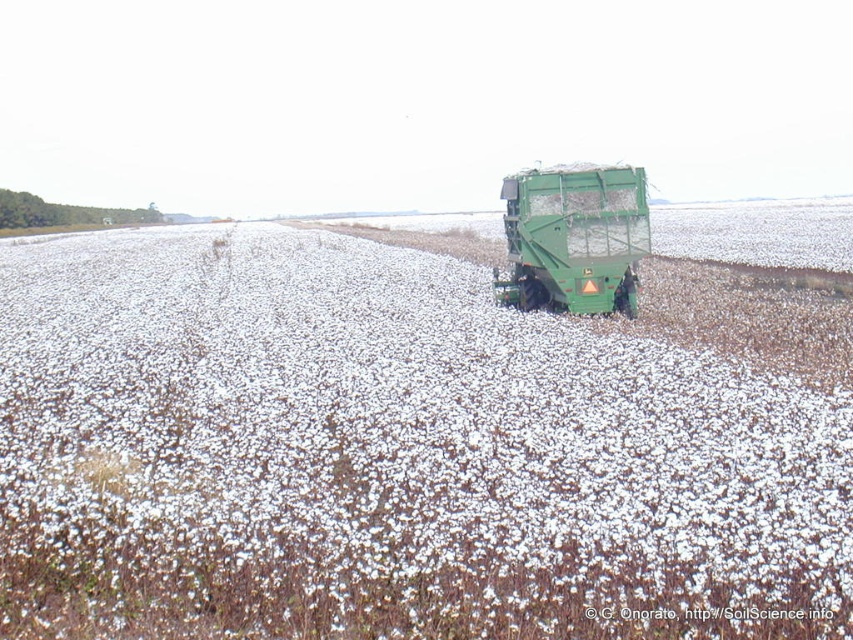
Question: Does white fluffy cotton at center appear on the left side of green matte truck at center?

Choices:
 (A) yes
 (B) no

Answer: (A)

Question: Which point is farther from the camera taking this photo?

Choices:
 (A) (631, 218)
 (B) (666, 541)

Answer: (A)

Question: Is white fluffy cotton at center further to camera compared to green matte truck at center?

Choices:
 (A) no
 (B) yes

Answer: (A)

Question: Can you confirm if white fluffy cotton at center is wider than green matte truck at center?

Choices:
 (A) yes
 (B) no

Answer: (A)